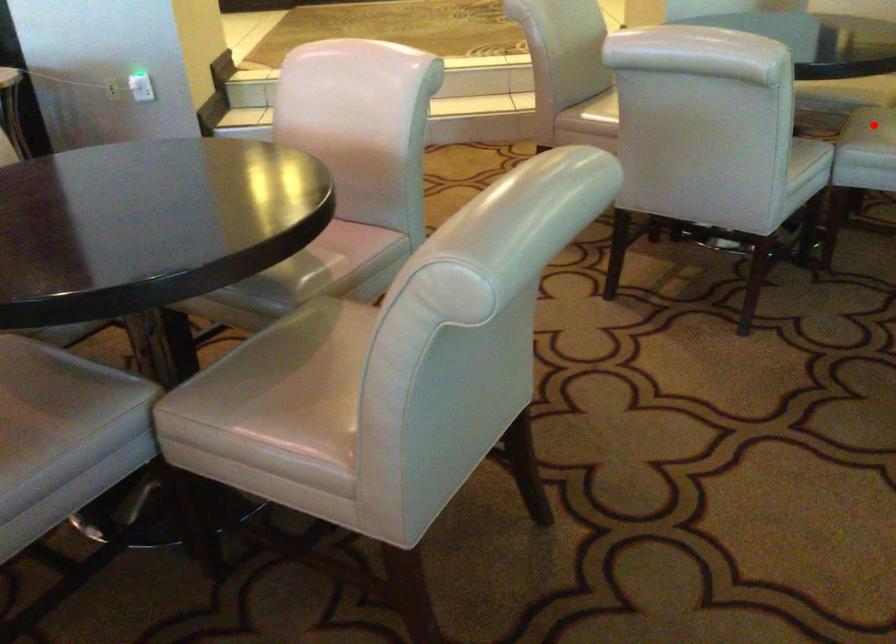
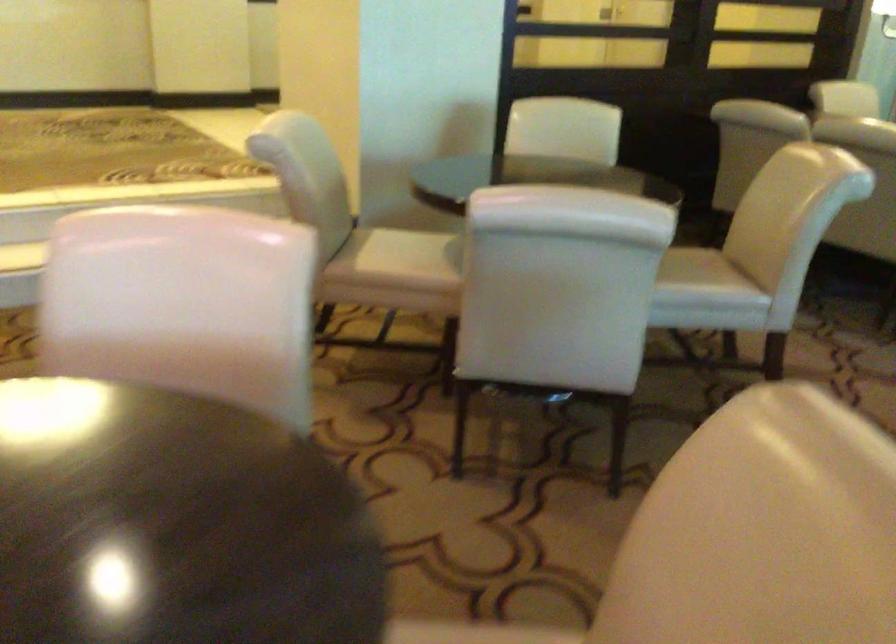
Question: I am providing you with two images of the same scene from different viewpoints. A red point is marked on the first image. Can you still see the location of the red point in image 2?

Choices:
 (A) Yes
 (B) No

Answer: (B)